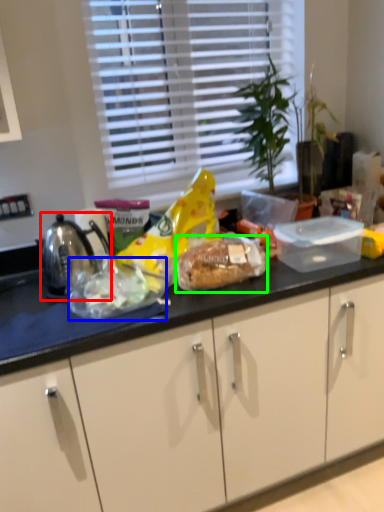
Question: Considering the real-world distances, which object is farthest from kettle (highlighted by a red box)? food (highlighted by a blue box) or snack (highlighted by a green box)?

Choices:
 (A) food
 (B) snack

Answer: (B)